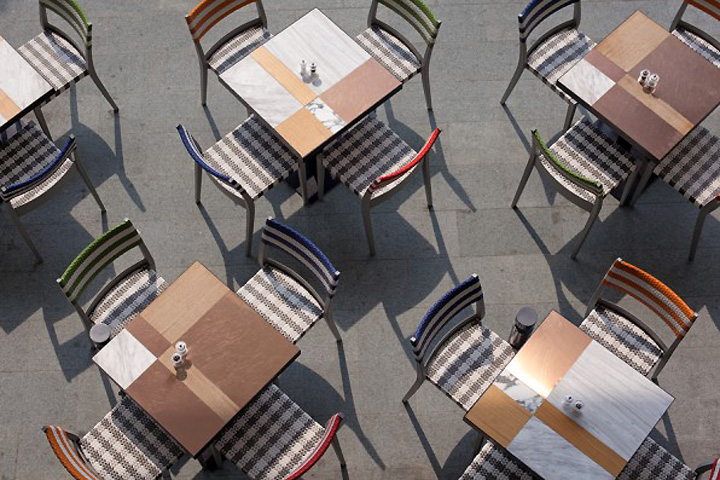
This screenshot has height=480, width=720. I want to click on salt and pepper shakers, so click(654, 77), click(641, 75), click(317, 67), click(300, 55), click(181, 346), click(176, 362), click(580, 410), click(562, 397).